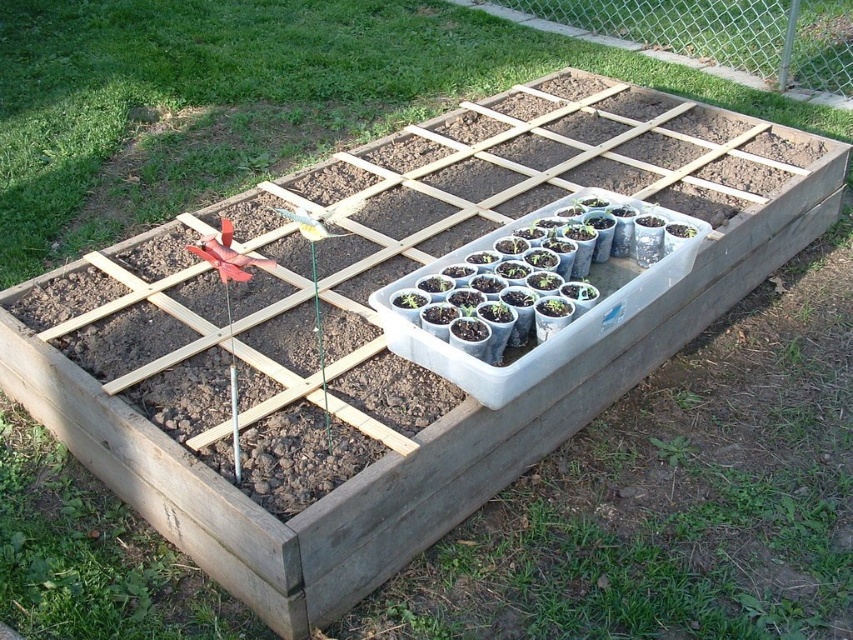
Describe the element at coordinates (248, 100) in the screenshot. I see `matte plastic tray at center` at that location.

Between matte plastic tray at center and clear plastic tray of seedlings at center, which one has less height?

clear plastic tray of seedlings at center is shorter.

Is point (97, 118) more distant than point (637, 291)?

Yes, it is behind point (637, 291).

This screenshot has height=640, width=853. I want to click on matte plastic tray at center, so click(x=248, y=100).